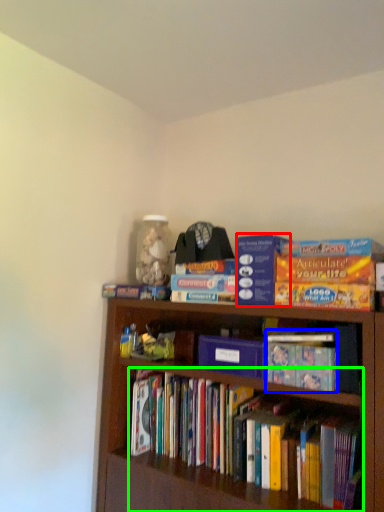
Question: Which is farther away from paperback book (highlighted by a red box)? book (highlighted by a blue box) or book (highlighted by a green box)?

Choices:
 (A) book
 (B) book

Answer: (B)